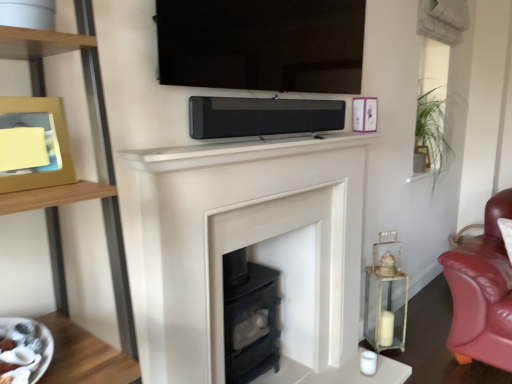
Find the location of `free point above black matte soundbar at center (from a real-world perspective)`. free point above black matte soundbar at center (from a real-world perspective) is located at coordinates (265, 98).